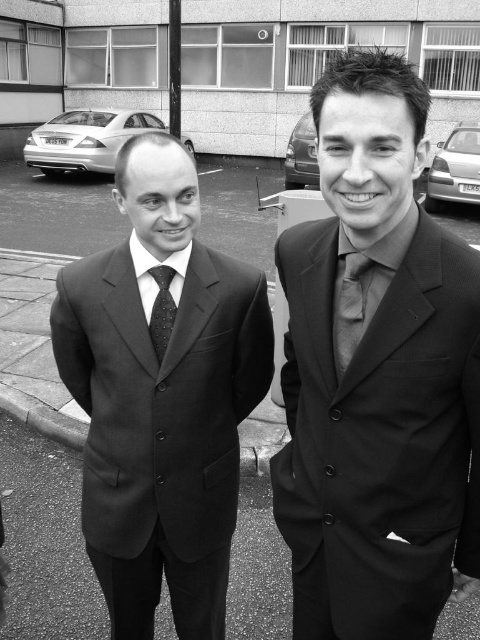
Can you confirm if black smooth suit at center is positioned above black dotted tie at center?

No.

Is black smooth suit at center smaller than black dotted tie at center?

Incorrect, black smooth suit at center is not smaller in size than black dotted tie at center.

Find the location of a particular element. The image size is (480, 640). black smooth suit at center is located at coordinates (162, 396).

Can you confirm if black satin suit at right is positioned above black dotted tie at center?

No, black satin suit at right is not above black dotted tie at center.

What do you see at coordinates (377, 378) in the screenshot? I see `black satin suit at right` at bounding box center [377, 378].

Where is `black satin suit at right`? black satin suit at right is located at coordinates (377, 378).

Does black satin suit at right have a larger size compared to matte gray tie at center?

Indeed, black satin suit at right has a larger size compared to matte gray tie at center.

Does point (327, 429) lie in front of point (348, 321)?

No, it is not.

At what (x,y) coordinates should I click in order to perform the action: click on black satin suit at right. Please return your answer as a coordinate pair (x, y). The width and height of the screenshot is (480, 640). Looking at the image, I should click on (377, 378).